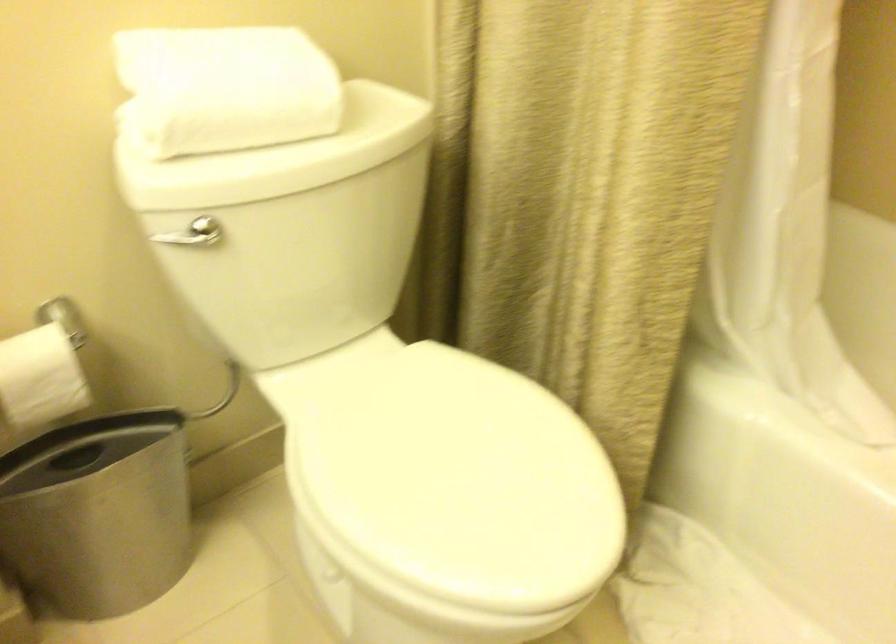
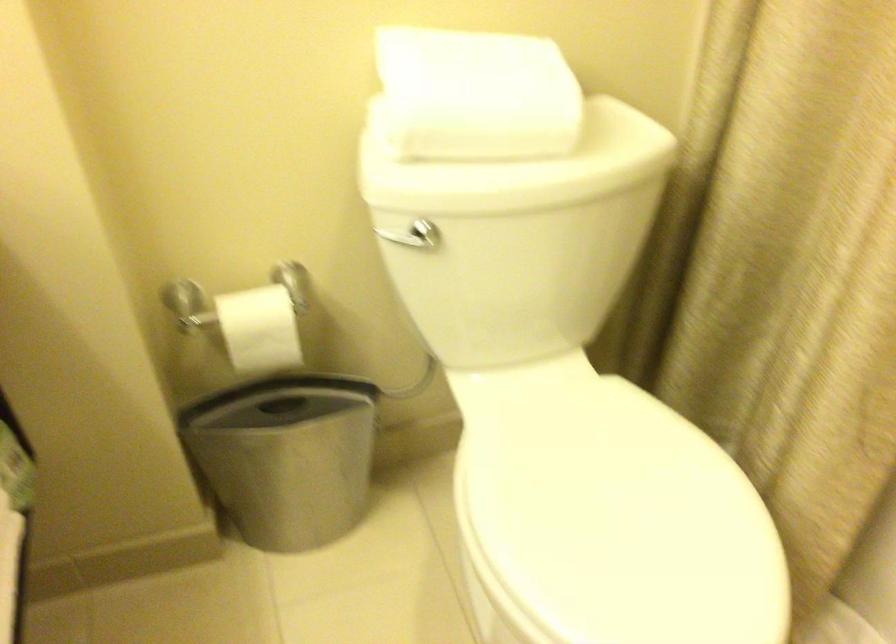
The images are taken continuously from a first-person perspective. In which direction are you moving?

The movement direction of the cameraman is right, forward.